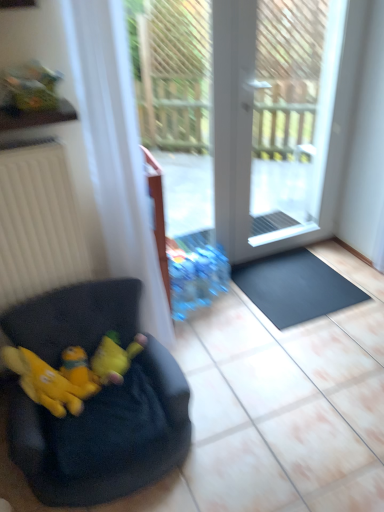
Question: Is yellow plush toy at lower left, the second animal positioned from the left, to the left or to the right of white glass screen door at center in the image?

Choices:
 (A) left
 (B) right

Answer: (A)

Question: From the image's perspective, is yellow plush toy at lower left, marked as the 1th animal in a right-to-left arrangement, located above or below white glass screen door at center?

Choices:
 (A) above
 (B) below

Answer: (B)

Question: Considering the real-world distances, which object is closest to the yellow plush toy at lower left, marked as the 1th animal in a right-to-left arrangement?

Choices:
 (A) yellow plush toy at lower left, which appears as the second animal when viewed from the right
 (B) white glass screen door at center
 (C) black fabric bean bag at lower left
 (D) white sheer curtain at left
 (E) yellow plush at left

Answer: (E)

Question: Estimate the real-world distances between objects in this image. Which object is closer to the yellow plush toy at lower left, marked as the 1th animal in a right-to-left arrangement?

Choices:
 (A) black rubber doormat at lower right
 (B) yellow plush toy at lower left, the first animal when ordered from left to right
 (C) white glass screen door at center
 (D) white sheer curtain at left
 (E) yellow plush at left

Answer: (E)